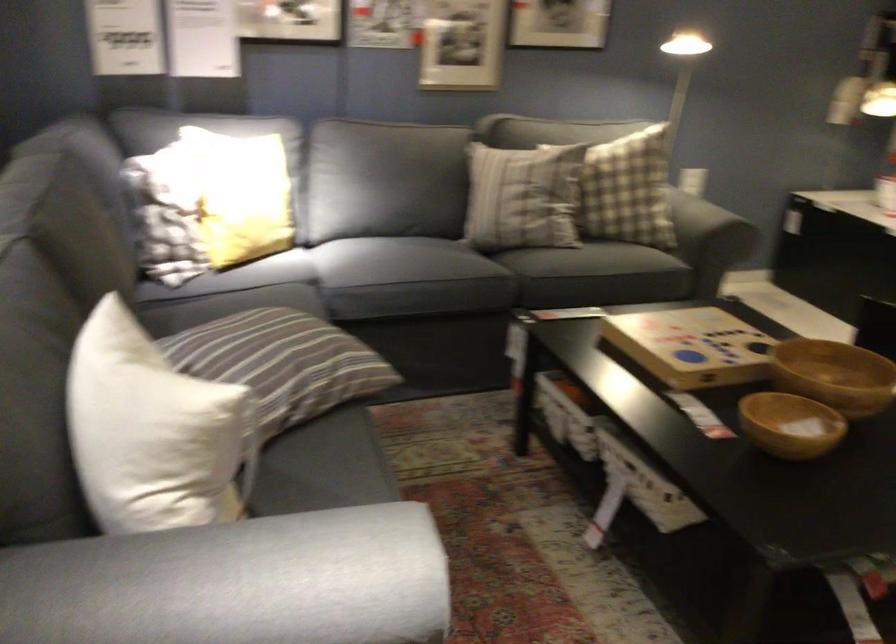
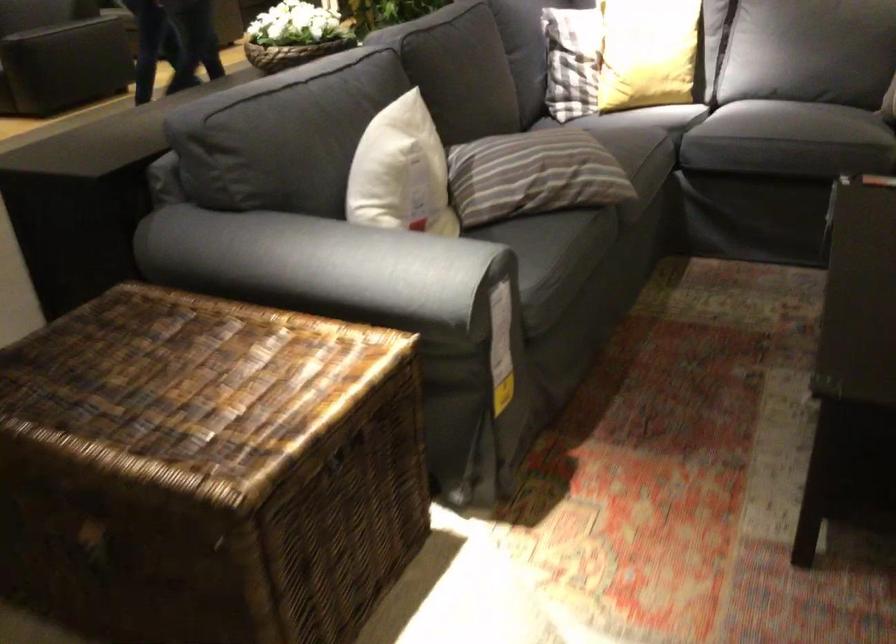
In the second image, find the point that corresponds to (x=295, y=212) in the first image.

(647, 53)